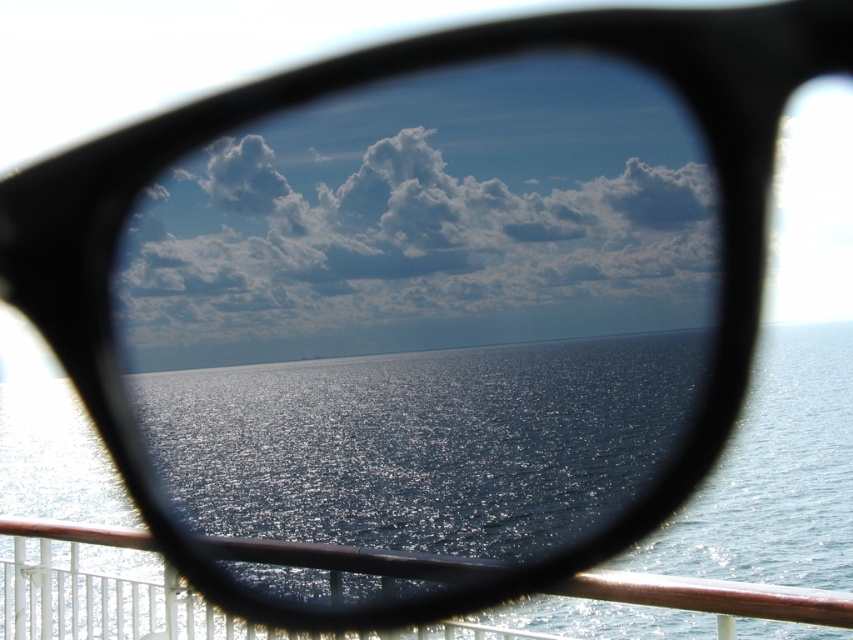
You are a photographer standing on a ship deck. You want to take a photo of the glistening blue water at center through your black sunglasses. Since the water is 3.35 meters away, will you need to adjust your camera focus to capture it clearly?

The glistening blue water at center is 3.35 meters away from the camera. To capture it clearly, you should adjust your camera focus to that distance.

You are on a ship and need to move from the metallic brown railing at lower center to the glistening blue water at center. Can you walk directly to the water without any obstacles?

The glistening blue water at center is 68.35 meters from the metallic brown railing at lower center, so you can walk directly to the water without any obstacles as there is enough space between them.